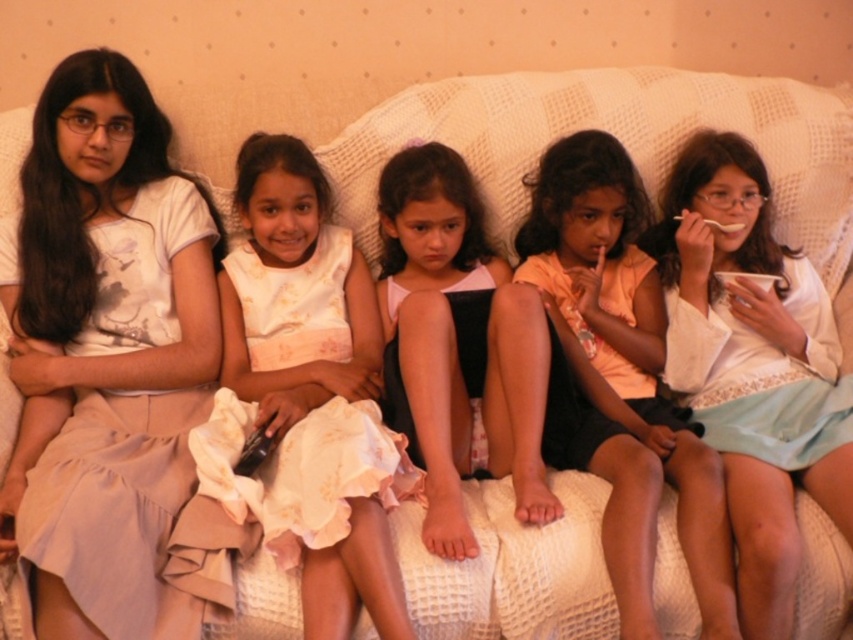
You are a photographer setting up a shoot in the living room. You need to position a small stool between the white cotton dress at left and the light pink fabric dress at center. Based on their heights, which dress should the stool be placed closer to?

The white cotton dress at left is much taller than the light pink fabric dress at center, so the stool should be placed closer to the light pink fabric dress at center to maintain balance between the two dresses.

You are a photographer trying to capture the girls on the couch. You notice the white cotton dress at center and the light pink fabric dress at center. Which dress should you focus on if you want to highlight the one that is positioned higher in the image?

The white cotton dress at center is located above the light pink fabric dress at center, so focusing on it will highlight the higher positioned dress.

You are standing in front of the couch where the five girls are sitting. You want to place a small gift exactly at the point with coordinates point (624, 376). Which girl is wearing the light pink fabric dress at center where you should place the gift?

The point (624, 376) is located on the light pink fabric dress at center, so you should place the gift on the light pink fabric dress at center.